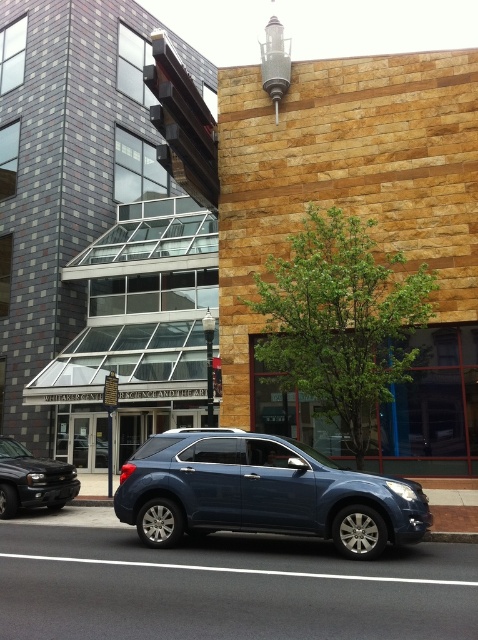
Question: Does satin blue suv at center have a lesser width compared to matte black suv at center?

Choices:
 (A) no
 (B) yes

Answer: (A)

Question: Does shiny black suv at lower left appear on the left side of matte black suv at center?

Choices:
 (A) no
 (B) yes

Answer: (A)

Question: Among these points, which one is nearest to the camera?

Choices:
 (A) (171, 474)
 (B) (28, 486)

Answer: (A)

Question: In this image, where is satin blue suv at center located relative to shiny black suv at lower left?

Choices:
 (A) below
 (B) above

Answer: (B)

Question: Among these points, which one is nearest to the camera?

Choices:
 (A) (93, 454)
 (B) (51, 474)
 (C) (351, 502)

Answer: (C)

Question: Which object is the farthest from the shiny black suv at lower left?

Choices:
 (A) matte black suv at center
 (B) satin blue suv at center

Answer: (A)